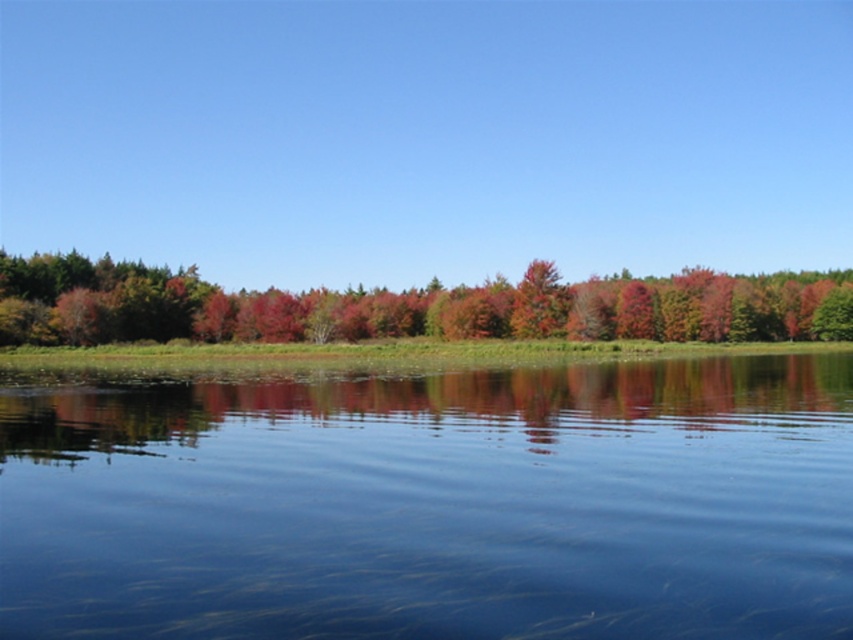
Does transparent water at center appear on the right side of green matte tree at center?

No, transparent water at center is not to the right of green matte tree at center.

Locate an element on the screen. transparent water at center is located at coordinates (436, 504).

Is transparent water at center above shiny red tree at center?

No, transparent water at center is not above shiny red tree at center.

Looking at this image, between transparent water at center and shiny red tree at center, which one is positioned lower?

Positioned lower is transparent water at center.

You are a GUI agent. You are given a task and a screenshot of the screen. Output one action in this format:
    pyautogui.click(x=<x>, y=<y>)
    Task: Click on the transparent water at center
    
    Given the screenshot: What is the action you would take?
    pyautogui.click(x=436, y=504)

Is green matte tree at center shorter than shiny red tree at center?

Yes, green matte tree at center is shorter than shiny red tree at center.

Does point (817, 323) come in front of point (518, 292)?

That is False.

The image size is (853, 640). I want to click on green matte tree at center, so click(410, 307).